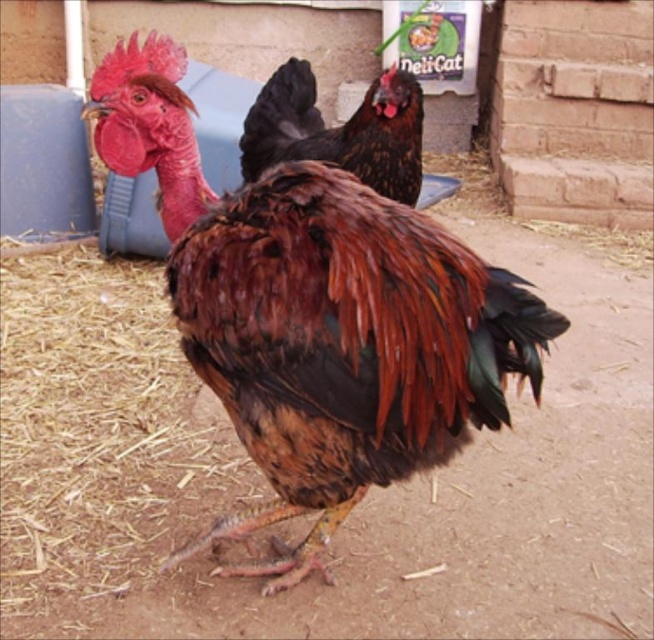
Does point (411, 232) come farther from viewer compared to point (370, 144)?

That is False.

Where is `brown feathered chicken at center`? brown feathered chicken at center is located at coordinates (315, 314).

Locate an element on the screen. Image resolution: width=654 pixels, height=640 pixels. brown feathered chicken at center is located at coordinates (315, 314).